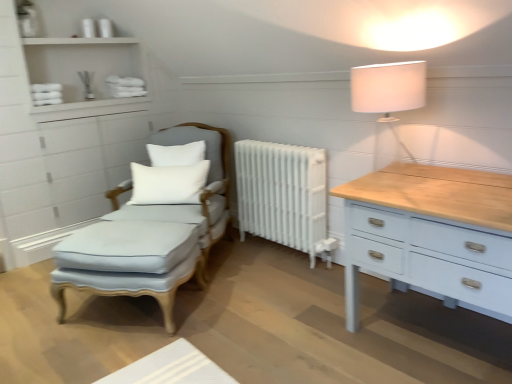
At what (x,y) coordinates should I click in order to perform the action: click on vacant area that lies to the right of light blue fabric swivel chair at center-left. Please return your answer as a coordinate pair (x, y). This screenshot has height=384, width=512. Looking at the image, I should click on (270, 268).